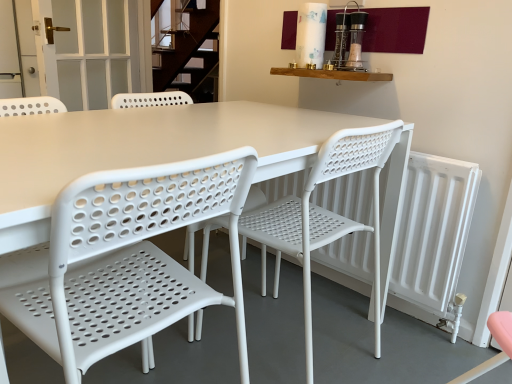
Identify the location of white matte radiator at right. This screenshot has width=512, height=384. (432, 232).

Describe the element at coordinates (432, 232) in the screenshot. I see `white matte radiator at right` at that location.

What do you see at coordinates (129, 260) in the screenshot? I see `white plastic chair at center, placed as the first chair when sorted from left to right` at bounding box center [129, 260].

The image size is (512, 384). What do you see at coordinates (324, 215) in the screenshot? I see `white plastic chair at center, the 2th chair from the left` at bounding box center [324, 215].

The height and width of the screenshot is (384, 512). In order to click on white frosted glass door at upper left in this screenshot , I will do `click(93, 50)`.

You are a GUI agent. You are given a task and a screenshot of the screen. Output one action in this format:
    pyautogui.click(x=<x>, y=<y>)
    Task: Click on the white matte radiator at right
    Image resolution: width=512 pixels, height=384 pixels.
    Given the screenshot: What is the action you would take?
    pyautogui.click(x=432, y=232)

Is point (55, 96) closer to viewer compared to point (67, 191)?

No, it is behind (67, 191).

Looking at this image, is white frosted glass door at upper left spatially inside white plastic chair at center, which ranks as the second chair in right-to-left order, or outside of it?

white frosted glass door at upper left is spatially situated outside white plastic chair at center, which ranks as the second chair in right-to-left order.

Can you confirm if white frosted glass door at upper left is positioned to the right of white plastic chair at center, placed as the first chair when sorted from left to right?

No.

Who is more distant, white frosted glass door at upper left or white plastic chair at center, placed as the first chair when sorted from left to right?

white frosted glass door at upper left is behind.

Can you confirm if white plastic chair at center, which ranks as the second chair in right-to-left order, is smaller than white plastic chair at center, the 2th chair from the left?

Correct, white plastic chair at center, which ranks as the second chair in right-to-left order, occupies less space than white plastic chair at center, the 2th chair from the left.

Is point (147, 226) positioned behind point (264, 253)?

No, (147, 226) is closer to viewer.

Is white plastic chair at center, placed as the first chair when sorted from left to right, wider than white plastic chair at center, the 2th chair from the left?

In fact, white plastic chair at center, placed as the first chair when sorted from left to right, might be narrower than white plastic chair at center, the 2th chair from the left.

Looking at this image, which point is more forward, (326, 220) or (66, 84)?

Point (326, 220)

Identify the location of screen door above the white plastic chair at center, placed as the 1th chair when sorted from right to left (from a real-world perspective). (93, 50).

Consider the image. Which object is positioned more to the left, white plastic chair at center, placed as the 1th chair when sorted from right to left, or white frosted glass door at upper left?

white frosted glass door at upper left.

Considering the positions of objects white plastic chair at center, the 2th chair from the left, and white frosted glass door at upper left in the image provided, who is behind, white plastic chair at center, the 2th chair from the left, or white frosted glass door at upper left?

white frosted glass door at upper left is further from the camera.

From a real-world perspective, is white plastic chair at center, which ranks as the second chair in right-to-left order, below white frosted glass door at upper left?

Yes, from a real-world perspective, white plastic chair at center, which ranks as the second chair in right-to-left order, is under white frosted glass door at upper left.

Is white frosted glass door at upper left at the back of white plastic chair at center, placed as the first chair when sorted from left to right?

white plastic chair at center, placed as the first chair when sorted from left to right, is not turned away from white frosted glass door at upper left.

From the image's perspective, is white plastic chair at center, placed as the first chair when sorted from left to right, located beneath white frosted glass door at upper left?

Yes.

Is white plastic chair at center, which ranks as the second chair in right-to-left order, to the left of white frosted glass door at upper left from the viewer's perspective?

No.

Does white frosted glass door at upper left have a lesser height compared to white matte radiator at right?

Yes.

Is white frosted glass door at upper left not near white matte radiator at right?

Yes, white frosted glass door at upper left and white matte radiator at right are quite far apart.

Who is smaller, white frosted glass door at upper left or white matte radiator at right?

white matte radiator at right is smaller.

Considering the relative positions of white frosted glass door at upper left and white matte radiator at right in the image provided, is white frosted glass door at upper left to the left or to the right of white matte radiator at right?

white frosted glass door at upper left is to the left of white matte radiator at right.

From a real-world perspective, does white frosted glass door at upper left sit lower than white plastic chair at center, the 2th chair from the left?

Actually, white frosted glass door at upper left is physically above white plastic chair at center, the 2th chair from the left, in the real world.

From the image's perspective, would you say white frosted glass door at upper left is positioned over white plastic chair at center, the 2th chair from the left?

Yes, from the image's perspective, white frosted glass door at upper left is over white plastic chair at center, the 2th chair from the left.

Choose the correct answer: Is white frosted glass door at upper left inside white plastic chair at center, the 2th chair from the left, or outside it?

white frosted glass door at upper left is not enclosed by white plastic chair at center, the 2th chair from the left.

Between point (202, 262) and point (273, 187), which one is positioned in front?

The point (273, 187) is in front.

Is white matte radiator at right located within white plastic chair at center, placed as the 1th chair when sorted from right to left?

No, white matte radiator at right is not surrounded by white plastic chair at center, placed as the 1th chair when sorted from right to left.

Is white plastic chair at center, the 2th chair from the left, at the right side of white matte radiator at right?

No, white plastic chair at center, the 2th chair from the left, is not to the right of white matte radiator at right.

Find the location of `screen door behind the white plastic chair at center, which ranks as the second chair in right-to-left order`. screen door behind the white plastic chair at center, which ranks as the second chair in right-to-left order is located at coordinates (93, 50).

Find the location of a particular element. chair that appears below the white plastic chair at center, the 2th chair from the left (from the image's perspective) is located at coordinates (129, 260).

Estimate the real-world distances between objects in this image. Which object is further from white frosted glass door at upper left, white matte radiator at right or white plastic chair at center, which ranks as the second chair in right-to-left order?

white plastic chair at center, which ranks as the second chair in right-to-left order, is positioned further to the anchor white frosted glass door at upper left.

Looking at the image, which one is located closer to white frosted glass door at upper left, white plastic chair at center, placed as the first chair when sorted from left to right, or white plastic chair at center, the 2th chair from the left?

white plastic chair at center, the 2th chair from the left.

From the picture: Based on their spatial positions, is white plastic chair at center, which ranks as the second chair in right-to-left order, or white frosted glass door at upper left further from white plastic chair at center, placed as the 1th chair when sorted from right to left?

white frosted glass door at upper left lies further to white plastic chair at center, placed as the 1th chair when sorted from right to left, than the other object.

Considering their positions, is white plastic chair at center, the 2th chair from the left, positioned closer to white frosted glass door at upper left than white matte radiator at right?

white plastic chair at center, the 2th chair from the left, is closer to white frosted glass door at upper left.

Estimate the real-world distances between objects in this image. Which object is further from white frosted glass door at upper left, white plastic chair at center, placed as the 1th chair when sorted from right to left, or white plastic chair at center, which ranks as the second chair in right-to-left order?

white plastic chair at center, which ranks as the second chair in right-to-left order, is positioned further to the anchor white frosted glass door at upper left.

When comparing their distances from white frosted glass door at upper left, does white matte radiator at right or white plastic chair at center, placed as the 1th chair when sorted from right to left, seem further?

Among the two, white matte radiator at right is located further to white frosted glass door at upper left.

Estimate the real-world distances between objects in this image. Which object is closer to white matte radiator at right, white frosted glass door at upper left or white plastic chair at center, which ranks as the second chair in right-to-left order?

white plastic chair at center, which ranks as the second chair in right-to-left order.

Looking at this image, which object lies nearer to the anchor point white matte radiator at right, white plastic chair at center, the 2th chair from the left, or white frosted glass door at upper left?

white plastic chair at center, the 2th chair from the left, lies closer to white matte radiator at right than the other object.

The width and height of the screenshot is (512, 384). I want to click on radiator located between white plastic chair at center, which ranks as the second chair in right-to-left order, and white frosted glass door at upper left in the depth direction, so click(x=432, y=232).

This screenshot has height=384, width=512. I want to click on chair located between white plastic chair at center, which ranks as the second chair in right-to-left order, and white frosted glass door at upper left in the depth direction, so click(324, 215).

Locate an element on the screen. The image size is (512, 384). chair located between white plastic chair at center, which ranks as the second chair in right-to-left order, and white matte radiator at right in the depth direction is located at coordinates (324, 215).